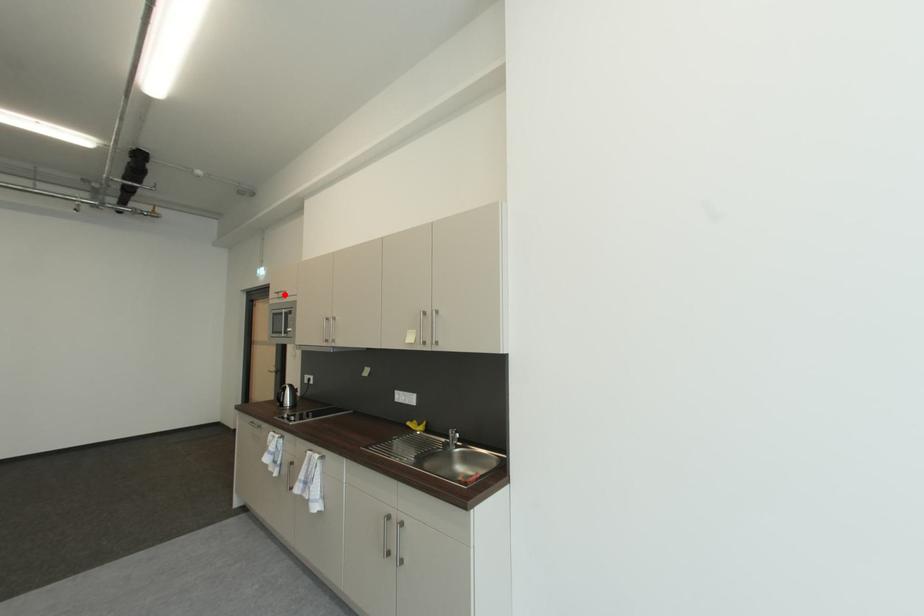
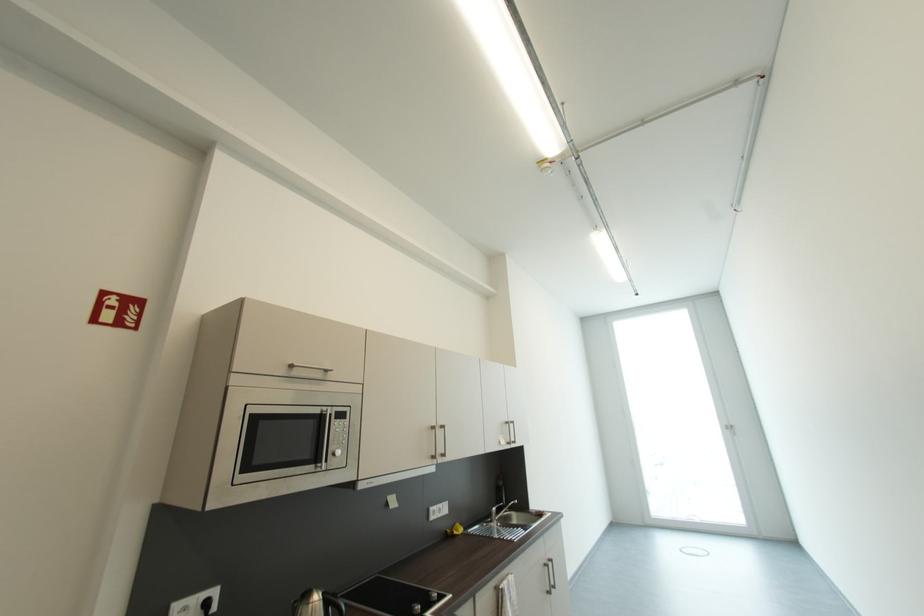
Find the pixel in the second image that matches the highlighted location in the first image.

(298, 368)